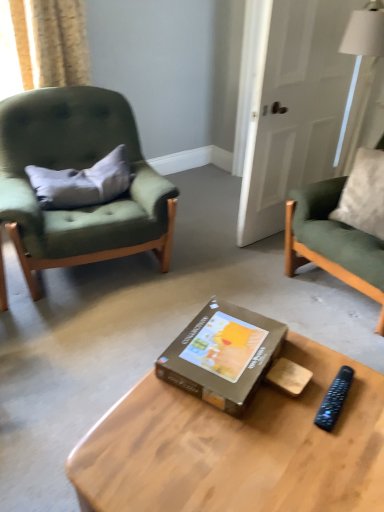
Where is `unoccupied area behind black plastic remote at lower right`? This screenshot has width=384, height=512. unoccupied area behind black plastic remote at lower right is located at coordinates (317, 361).